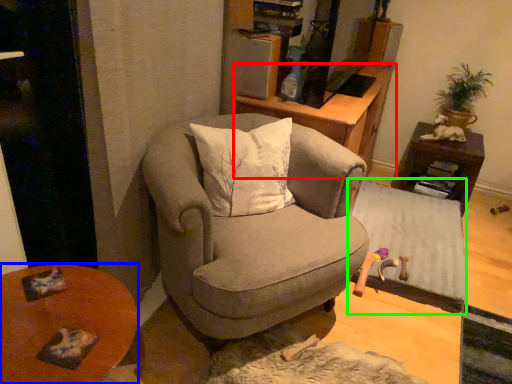
Question: Which object is the farthest from cabinetry (highlighted by a red box)? Choose among these: desk (highlighted by a blue box) or table (highlighted by a green box).

Choices:
 (A) desk
 (B) table

Answer: (A)